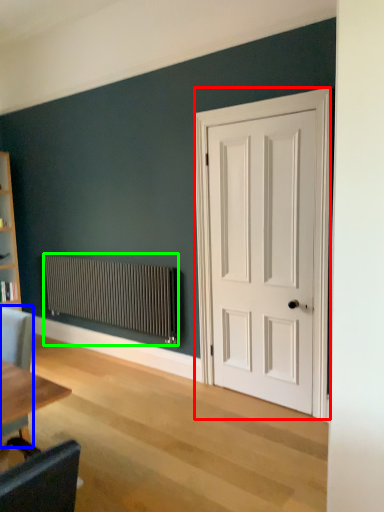
Question: Estimate the real-world distances between objects in this image. Which object is farther from door (highlighted by a red box), chair (highlighted by a blue box) or radiator (highlighted by a green box)?

Choices:
 (A) chair
 (B) radiator

Answer: (A)